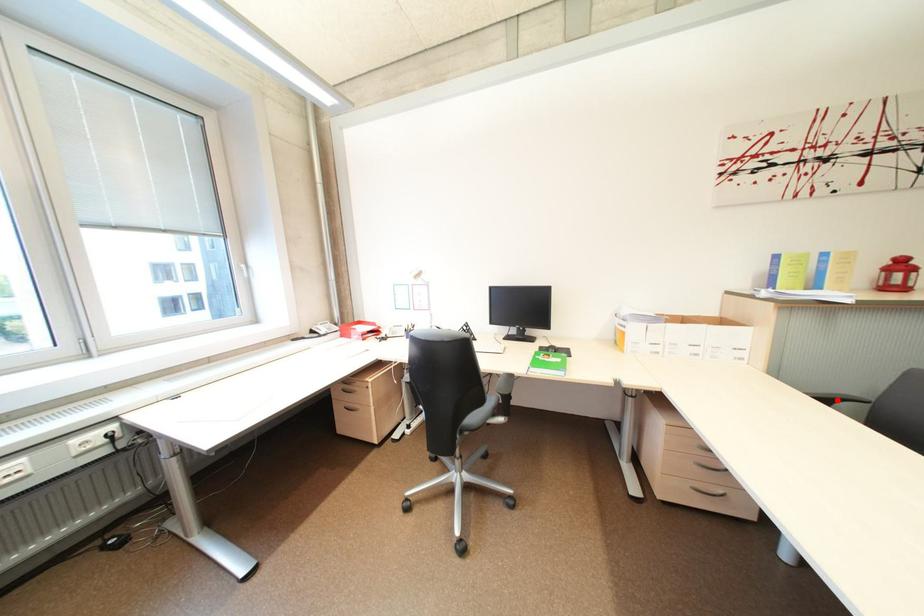
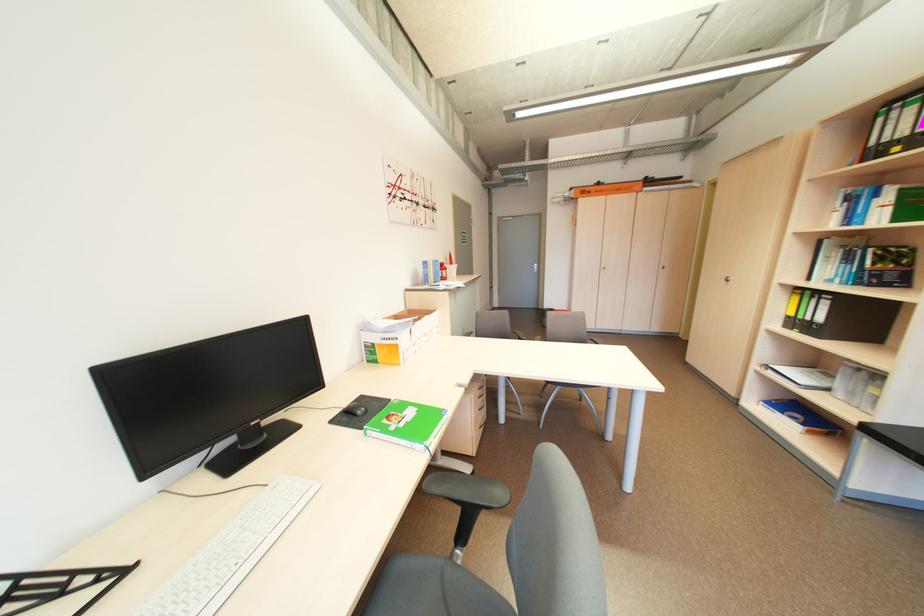
Question: I am providing you with two images of the same scene from different viewpoints. A red point is marked on the first image. Is the red point's position out of view in image 2?

Choices:
 (A) Yes
 (B) No

Answer: (A)